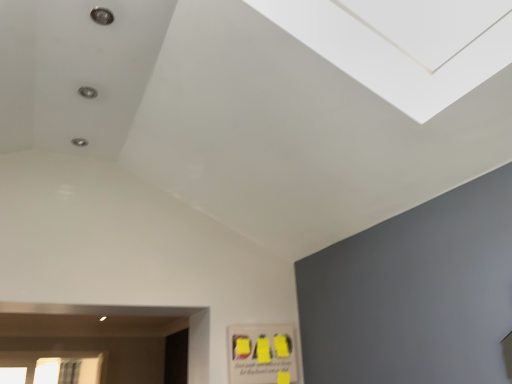
Describe the element at coordinates (261, 354) in the screenshot. I see `yellow matte poster at lower right` at that location.

Identify the location of yellow matte poster at lower right. The image size is (512, 384). (261, 354).

Describe the element at coordinates (53, 359) in the screenshot. I see `white glass window at lower left` at that location.

What is the approximate height of white glass window at lower left?

The height of white glass window at lower left is 14.15 inches.

The image size is (512, 384). In order to click on white glass window at lower left in this screenshot , I will do `click(53, 359)`.

Locate an element on the screen. The width and height of the screenshot is (512, 384). yellow matte poster at lower right is located at coordinates (261, 354).

Is yellow matte poster at lower right to the left or to the right of white glass window at lower left in the image?

In the image, yellow matte poster at lower right appears on the right side of white glass window at lower left.

Is yellow matte poster at lower right in front of or behind white glass window at lower left in the image?

In the image, yellow matte poster at lower right appears in front of white glass window at lower left.

Between point (245, 348) and point (36, 368), which one is positioned behind?

The point (36, 368) is farther from the camera.

From the image's perspective, is yellow matte poster at lower right positioned above or below white glass window at lower left?

yellow matte poster at lower right is above white glass window at lower left.

Consider the image. From a real-world perspective, which is physically below, yellow matte poster at lower right or white glass window at lower left?

yellow matte poster at lower right, from a real-world perspective.

Does yellow matte poster at lower right have a lesser width compared to white glass window at lower left?

Indeed, yellow matte poster at lower right has a lesser width compared to white glass window at lower left.

Considering the relative sizes of yellow matte poster at lower right and white glass window at lower left in the image provided, is yellow matte poster at lower right shorter than white glass window at lower left?

Yes.

Considering the sizes of yellow matte poster at lower right and white glass window at lower left in the image, is yellow matte poster at lower right bigger or smaller than white glass window at lower left?

In the image, yellow matte poster at lower right appears to be smaller than white glass window at lower left.

Is yellow matte poster at lower right completely or partially outside of white glass window at lower left?

That's correct, yellow matte poster at lower right is outside of white glass window at lower left.

Would you say yellow matte poster at lower right is a long distance from white glass window at lower left?

Yes, yellow matte poster at lower right is far from white glass window at lower left.

Consider the image. Is yellow matte poster at lower right aimed at white glass window at lower left?

No, yellow matte poster at lower right is not oriented towards white glass window at lower left.

How many degrees apart are the facing directions of yellow matte poster at lower right and white glass window at lower left?

There is a 0.766-degree angle between the facing directions of yellow matte poster at lower right and white glass window at lower left.

Measure the distance between yellow matte poster at lower right and white glass window at lower left.

yellow matte poster at lower right and white glass window at lower left are 4.02 meters apart.

The image size is (512, 384). Find the location of `poster located on the right of white glass window at lower left`. poster located on the right of white glass window at lower left is located at coordinates (261, 354).

Is white glass window at lower left at the right side of yellow matte poster at lower right?

No, white glass window at lower left is not to the right of yellow matte poster at lower right.

Is white glass window at lower left further to the viewer compared to yellow matte poster at lower right?

Yes, white glass window at lower left is further from the viewer.

Is point (100, 352) closer to camera compared to point (263, 348)?

That is False.

From the image's perspective, relative to yellow matte poster at lower right, is white glass window at lower left above or below?

From the image's perspective, white glass window at lower left appears below yellow matte poster at lower right.

From a real-world perspective, which is physically above, white glass window at lower left or yellow matte poster at lower right?

white glass window at lower left, from a real-world perspective.

Considering the relative sizes of white glass window at lower left and yellow matte poster at lower right in the image provided, is white glass window at lower left thinner than yellow matte poster at lower right?

Incorrect, the width of white glass window at lower left is not less than that of yellow matte poster at lower right.

Who is taller, white glass window at lower left or yellow matte poster at lower right?

With more height is white glass window at lower left.

Who is smaller, white glass window at lower left or yellow matte poster at lower right?

With smaller size is yellow matte poster at lower right.

Is white glass window at lower left inside the boundaries of yellow matte poster at lower right, or outside?

white glass window at lower left lies outside yellow matte poster at lower right.

Does white glass window at lower left touch yellow matte poster at lower right?

A: white glass window at lower left and yellow matte poster at lower right are not in contact.

Is white glass window at lower left aimed at yellow matte poster at lower right?

Yes, white glass window at lower left is oriented towards yellow matte poster at lower right.

How many degrees apart are the facing directions of white glass window at lower left and yellow matte poster at lower right?

The angular difference between white glass window at lower left and yellow matte poster at lower right is 0.766 degrees.

In the image, there is a white glass window at lower left. Where is `poster below it (from a real-world perspective)`? poster below it (from a real-world perspective) is located at coordinates (261, 354).

The width and height of the screenshot is (512, 384). Identify the location of window behind the yellow matte poster at lower right. (53, 359).

Where is `poster above the white glass window at lower left (from the image's perspective)`? poster above the white glass window at lower left (from the image's perspective) is located at coordinates (261, 354).